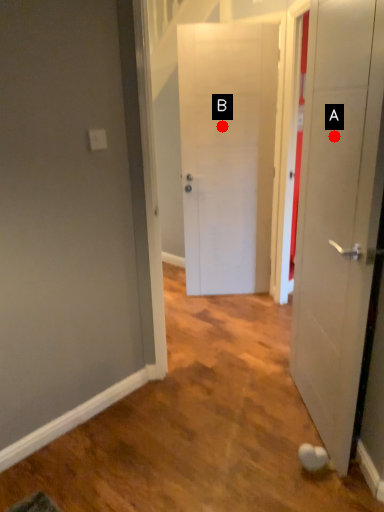
Question: Two points are circled on the image, labeled by A and B beside each circle. Which of the following is the closest to the observer?

Choices:
 (A) A is closer
 (B) B is closer

Answer: (A)